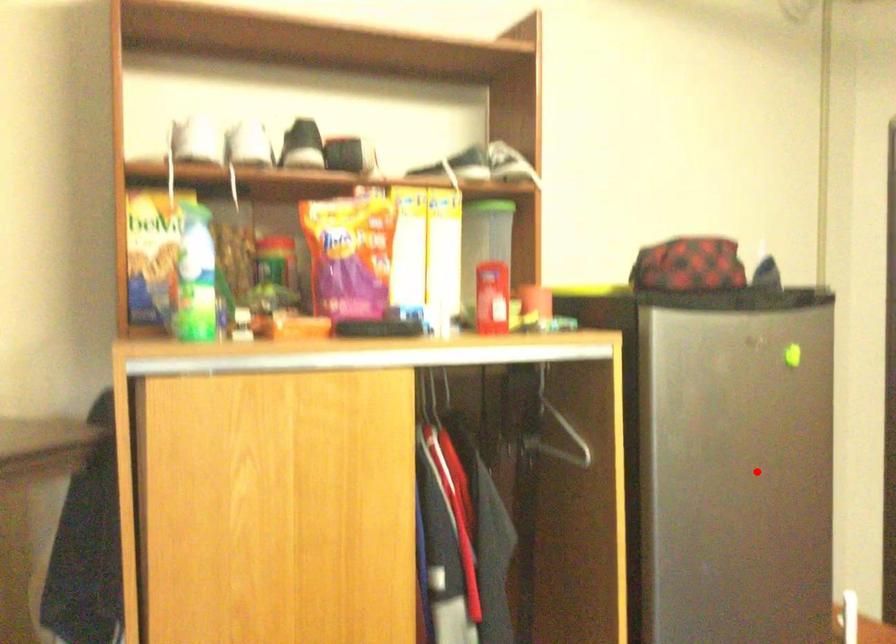
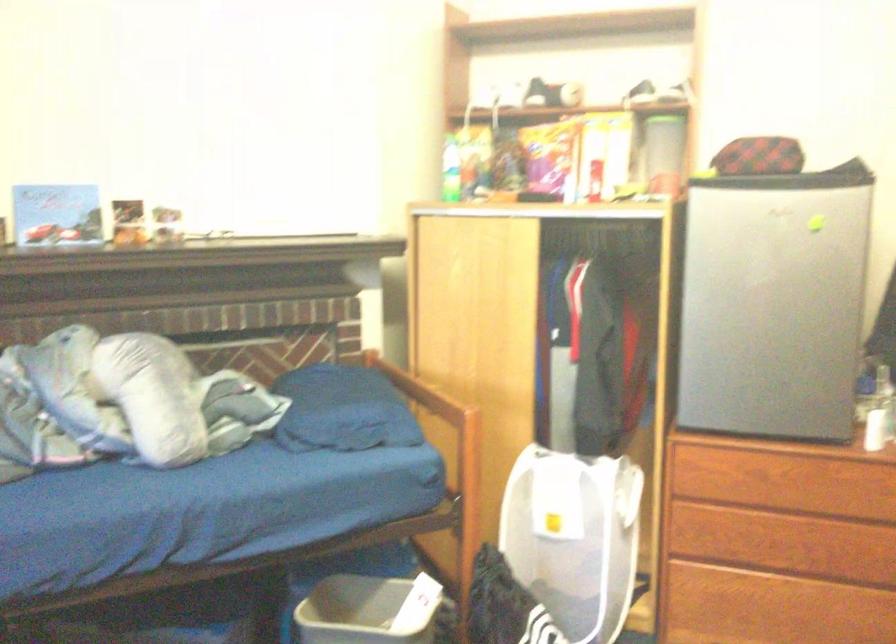
Question: I am providing you with two images of the same scene from different viewpoints. In image1, a red point is highlighted. Considering the same 3D point in image2, which of the following is correct?

Choices:
 (A) It is closer
 (B) It is farther

Answer: (B)